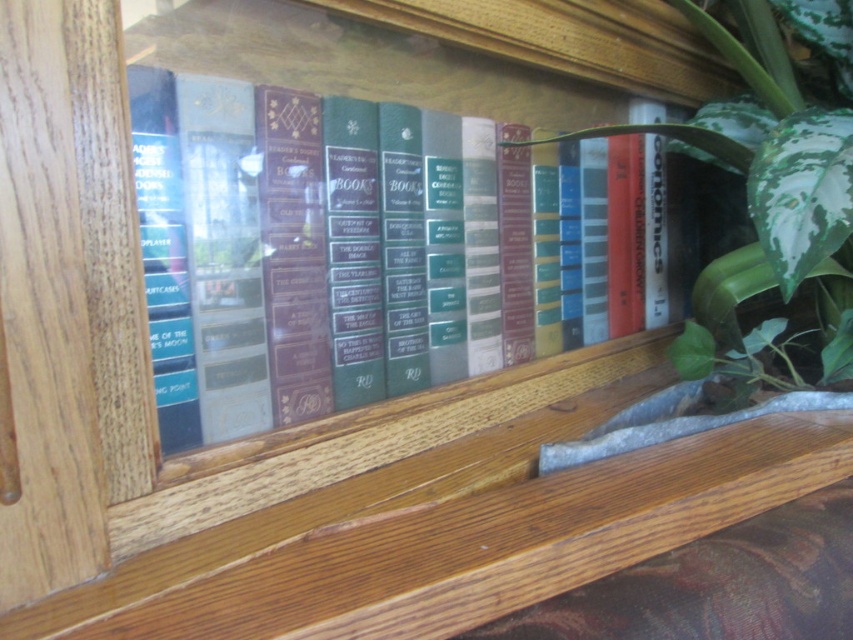
Between hardcover books at center and green leafy plant at right, which one appears on the right side from the viewer's perspective?

Positioned to the right is green leafy plant at right.

Does point (206, 269) come behind point (755, 376)?

No, (206, 269) is closer to viewer.

You are a GUI agent. You are given a task and a screenshot of the screen. Output one action in this format:
    pyautogui.click(x=<x>, y=<y>)
    Task: Click on the hardcover books at center
    Image resolution: width=853 pixels, height=640 pixels.
    Given the screenshot: What is the action you would take?
    pyautogui.click(x=268, y=266)